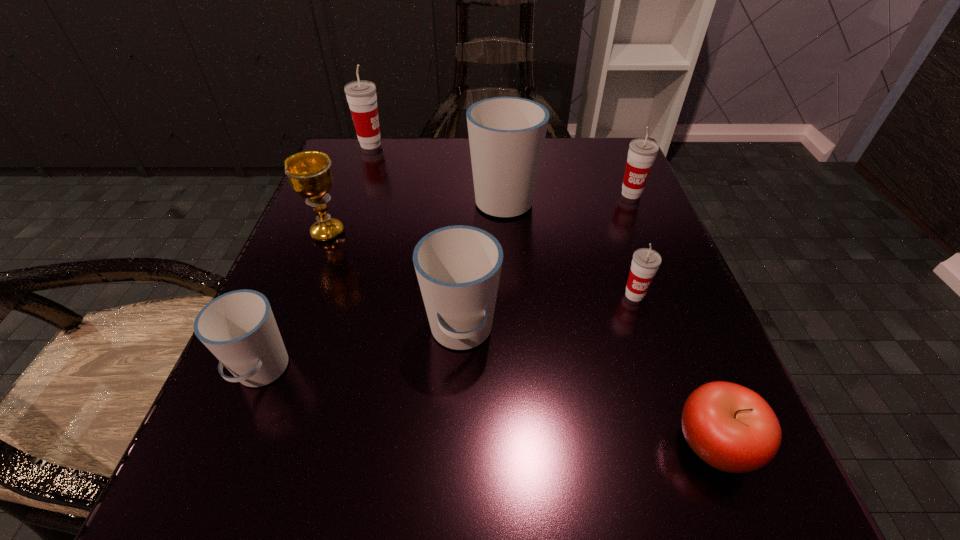
This screenshot has width=960, height=540. Find the location of `free area in between the gold chalice and the biggest white cup`. free area in between the gold chalice and the biggest white cup is located at coordinates (416, 216).

Choose which object is the nearest neighbor to the second red cup from right to left. Please provide its 2D coordinates. Your answer should be formatted as a tuple, i.e. [(x, y)], where the tuple contains the x and y coordinates of a point satisfying the conditions above.

[(733, 429)]

The width and height of the screenshot is (960, 540). In order to click on object identified as the sixth closest to the nearest object in this screenshot , I will do `click(309, 172)`.

Locate which cup is the second closest to the farthest white cup. Please provide its 2D coordinates. Your answer should be formatted as a tuple, i.e. [(x, y)], where the tuple contains the x and y coordinates of a point satisfying the conditions above.

[(458, 268)]

Identify which cup is the third nearest to the biggest white cup. Please provide its 2D coordinates. Your answer should be formatted as a tuple, i.e. [(x, y)], where the tuple contains the x and y coordinates of a point satisfying the conditions above.

[(645, 263)]

Select which red cup appears as the closest to the second red cup from left to right. Please provide its 2D coordinates. Your answer should be formatted as a tuple, i.e. [(x, y)], where the tuple contains the x and y coordinates of a point satisfying the conditions above.

[(642, 152)]

I want to click on red cup that is the closest to the second smallest white cup, so click(645, 263).

Image resolution: width=960 pixels, height=540 pixels. Find the location of `white cup that stands as the second closest to the second nearest red cup`. white cup that stands as the second closest to the second nearest red cup is located at coordinates (458, 268).

This screenshot has width=960, height=540. I want to click on the second closest white cup to the smallest white cup, so click(506, 134).

Where is `free space that satisfies the following two spatial constraints: 1. with a handle on the side of the farthest white cup; 2. on the side of the farthest object with the logo`? This screenshot has width=960, height=540. free space that satisfies the following two spatial constraints: 1. with a handle on the side of the farthest white cup; 2. on the side of the farthest object with the logo is located at coordinates (500, 145).